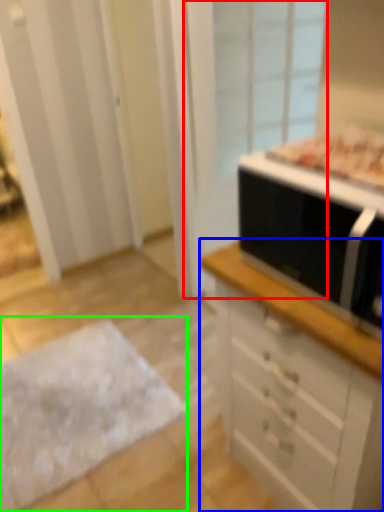
Question: Considering the real-world distances, which object is closest to screen door (highlighted by a red box)? chest of drawers (highlighted by a blue box) or flat (highlighted by a green box).

Choices:
 (A) chest of drawers
 (B) flat

Answer: (B)